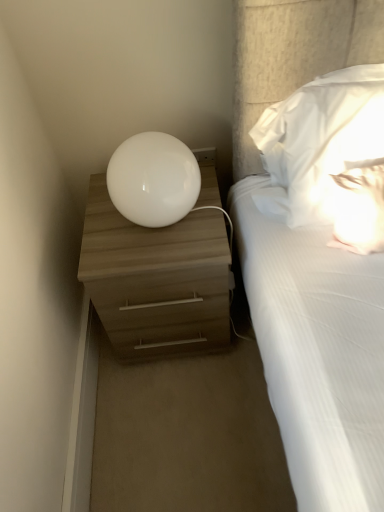
Locate an element on the screen. This screenshot has width=384, height=512. vacant area that lies in front of white glossy sphere at upper center is located at coordinates (160, 257).